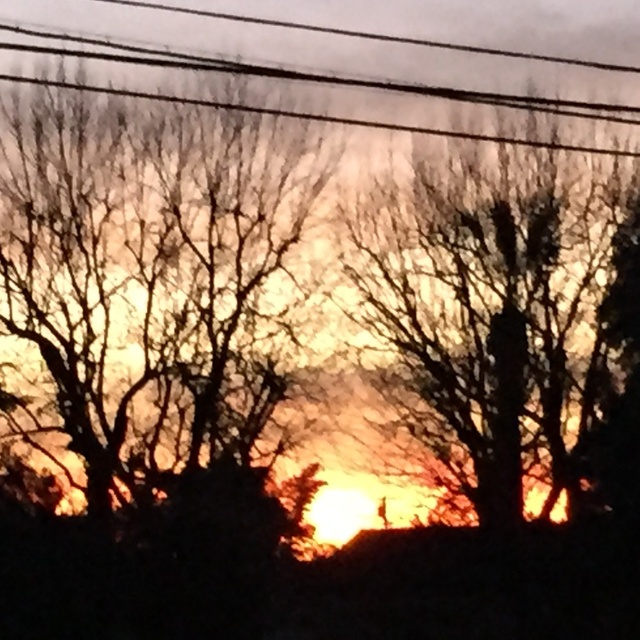
You are standing in front of the sunset scene and want to determine which tree is closer to you. Looking at the silhouette bark tree at center and the silhouette bare tree at center, which one appears nearer based on their positioning?

The silhouette bark tree at center appears nearer because it is closer to the viewer than the silhouette bare tree at center.

Looking at this image, you are an artist trying to draw the sunset scene. You need to place the silhouette bare tree at center and the black wire at upper center accurately. According to the scene, which object is located to the right of the other?

The silhouette bare tree at center is positioned on the right side of black wire at upper center.

You are an artist trying to sketch this sunset scene. You notice the silhouette bark tree at center and the black wire at upper center. Which object should you draw first to maintain proper perspective, considering their sizes?

The silhouette bark tree at center should be drawn first because it is smaller than the black wire at upper center, indicating it is farther away and thus should be placed in the background.